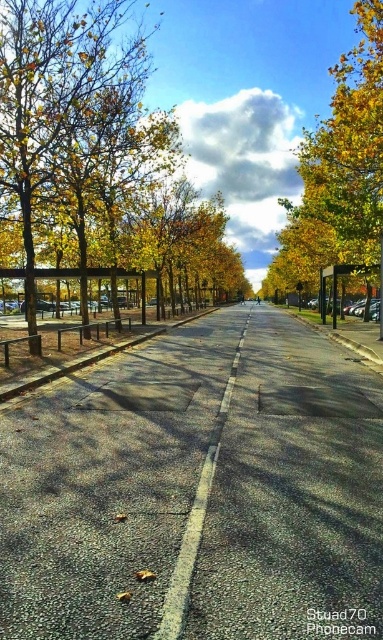
Between yellow leafy tree at center and white asphalt road at center, which one appears on the left side from the viewer's perspective?

Positioned to the left is yellow leafy tree at center.

Is yellow leafy tree at center above white asphalt road at center?

Correct, yellow leafy tree at center is located above white asphalt road at center.

Between point (204, 220) and point (230, 392), which one is positioned behind?

Positioned behind is point (204, 220).

Image resolution: width=383 pixels, height=640 pixels. What are the coordinates of `yellow leafy tree at center` in the screenshot? It's located at (98, 161).

Does yellow leafy tree at center have a larger size compared to metallic bus stop at center-right?

Indeed, yellow leafy tree at center has a larger size compared to metallic bus stop at center-right.

Which of these two, yellow leafy tree at center or metallic bus stop at center-right, stands shorter?

With less height is metallic bus stop at center-right.

The width and height of the screenshot is (383, 640). I want to click on yellow leafy tree at center, so click(98, 161).

Does white asphalt road at center appear on the left side of metallic bus stop at center-right?

Indeed, white asphalt road at center is positioned on the left side of metallic bus stop at center-right.

Who is lower down, white asphalt road at center or metallic bus stop at center-right?

white asphalt road at center

Which is in front, point (189, 525) or point (361, 273)?

Point (189, 525)

In order to click on white asphalt road at center in this screenshot , I will do `click(196, 516)`.